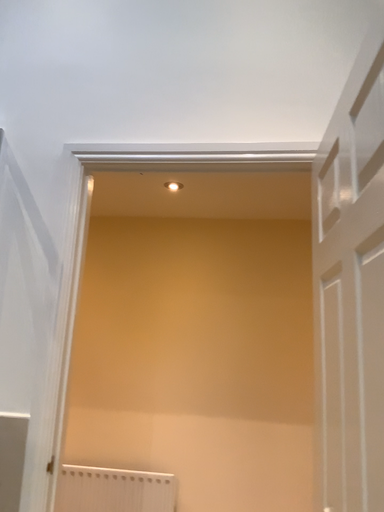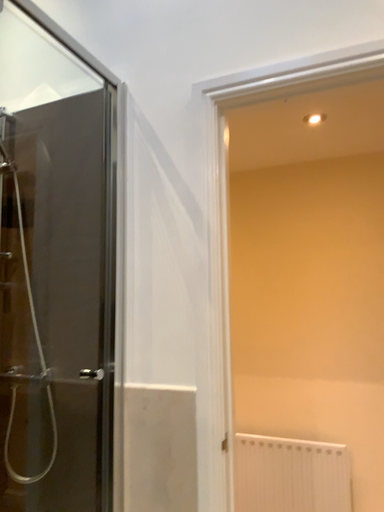
Question: Which way did the camera rotate in the video?

Choices:
 (A) rotated right
 (B) rotated left

Answer: (B)